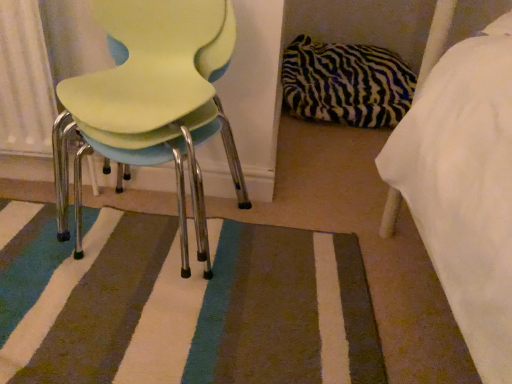
In order to click on free space on the front side of matte plastic chair at left in this screenshot , I will do `click(133, 327)`.